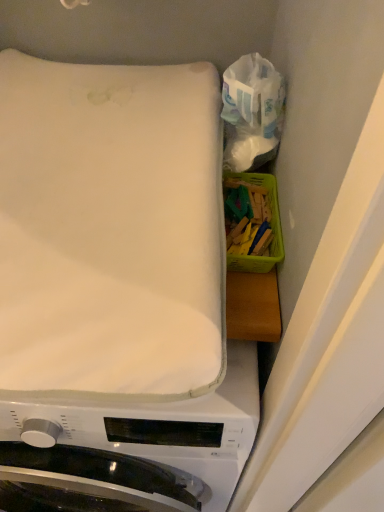
Question: Is translucent plastic bag at upper right looking in the opposite direction of white soft mattress at upper left?

Choices:
 (A) no
 (B) yes

Answer: (A)

Question: Can you confirm if translucent plastic bag at upper right is taller than white soft mattress at upper left?

Choices:
 (A) no
 (B) yes

Answer: (B)

Question: Can you confirm if translucent plastic bag at upper right is wider than white soft mattress at upper left?

Choices:
 (A) yes
 (B) no

Answer: (B)

Question: From a real-world perspective, is translucent plastic bag at upper right located beneath white soft mattress at upper left?

Choices:
 (A) no
 (B) yes

Answer: (A)

Question: Are translucent plastic bag at upper right and white soft mattress at upper left far apart?

Choices:
 (A) yes
 (B) no

Answer: (B)

Question: From the image's perspective, is translucent plastic bag at upper right located beneath white soft mattress at upper left?

Choices:
 (A) yes
 (B) no

Answer: (B)

Question: Is white soft mattress at upper left thinner than translucent plastic bag at upper right?

Choices:
 (A) yes
 (B) no

Answer: (B)

Question: Would you say translucent plastic bag at upper right is part of white soft mattress at upper left's contents?

Choices:
 (A) yes
 (B) no

Answer: (B)

Question: Can you confirm if white soft mattress at upper left is taller than translucent plastic bag at upper right?

Choices:
 (A) no
 (B) yes

Answer: (A)

Question: Is white soft mattress at upper left closer to the viewer compared to translucent plastic bag at upper right?

Choices:
 (A) yes
 (B) no

Answer: (A)

Question: Is translucent plastic bag at upper right at the back of white soft mattress at upper left?

Choices:
 (A) yes
 (B) no

Answer: (B)

Question: Is white soft mattress at upper left aimed at translucent plastic bag at upper right?

Choices:
 (A) yes
 (B) no

Answer: (B)

Question: From a real-world perspective, is white soft mattress at upper left on white fabric at upper left?

Choices:
 (A) no
 (B) yes

Answer: (B)